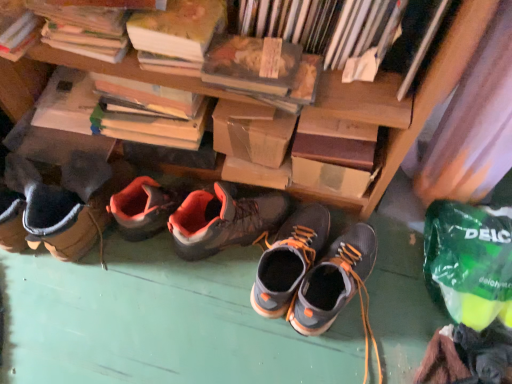
Question: Is matte gray and orange hiking boots at center, acting as the 1th footwear starting from the right, behind hardcover book at upper right, which ranks as the fourth book in left-to-right order?

Choices:
 (A) yes
 (B) no

Answer: (A)

Question: Is matte gray and orange hiking boots at center, the 3th footwear when ordered from left to right, looking in the opposite direction of hardcover book at upper right, arranged as the first book when viewed from the right?

Choices:
 (A) no
 (B) yes

Answer: (A)

Question: Does matte gray and orange hiking boots at center, acting as the 1th footwear starting from the right, have a greater height compared to hardcover book at upper right, which ranks as the fourth book in left-to-right order?

Choices:
 (A) no
 (B) yes

Answer: (A)

Question: Is matte gray and orange hiking boots at center, acting as the 1th footwear starting from the right, not within hardcover book at upper right, arranged as the first book when viewed from the right?

Choices:
 (A) yes
 (B) no

Answer: (A)

Question: Is matte gray and orange hiking boots at center, the 3th footwear when ordered from left to right, to the right of hardcover book at upper right, which ranks as the fourth book in left-to-right order, from the viewer's perspective?

Choices:
 (A) yes
 (B) no

Answer: (B)

Question: Are matte gray and orange hiking boots at center, the 3th footwear when ordered from left to right, and hardcover book at upper right, which ranks as the fourth book in left-to-right order, located far from each other?

Choices:
 (A) yes
 (B) no

Answer: (B)

Question: Considering the relative sizes of matte gray and orange hiking boots at center, acting as the 1th footwear starting from the right, and hardcover book at upper center in the image provided, is matte gray and orange hiking boots at center, acting as the 1th footwear starting from the right, taller than hardcover book at upper center?

Choices:
 (A) no
 (B) yes

Answer: (B)

Question: Are matte gray and orange hiking boots at center, the 3th footwear when ordered from left to right, and hardcover book at upper center making contact?

Choices:
 (A) no
 (B) yes

Answer: (A)

Question: Can you confirm if matte gray and orange hiking boots at center, the 3th footwear when ordered from left to right, is positioned to the left of hardcover book at upper center?

Choices:
 (A) no
 (B) yes

Answer: (A)

Question: Considering the relative positions of matte gray and orange hiking boots at center, the 3th footwear when ordered from left to right, and hardcover book at upper center in the image provided, is matte gray and orange hiking boots at center, the 3th footwear when ordered from left to right, to the right of hardcover book at upper center from the viewer's perspective?

Choices:
 (A) yes
 (B) no

Answer: (A)

Question: Is the depth of matte gray and orange hiking boots at center, acting as the 1th footwear starting from the right, less than that of hardcover book at upper center?

Choices:
 (A) yes
 (B) no

Answer: (B)

Question: Is hardcover book at upper left, the third book when ordered from right to left, at the back of hardcover book at upper right, arranged as the first book when viewed from the right?

Choices:
 (A) no
 (B) yes

Answer: (A)